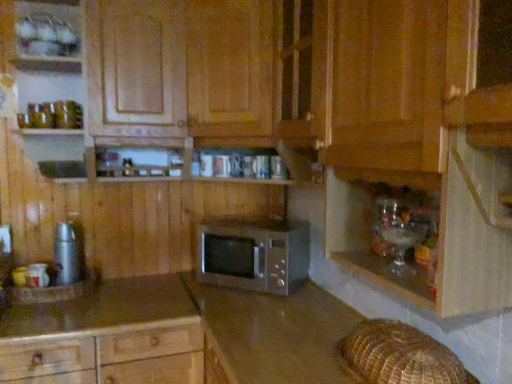
Question: Does wooden microwave at center, marked as the 2th cabinetry in a bottom-to-top arrangement, have a larger size compared to satin brown microwave at center, acting as the second cabinetry starting from the top?

Choices:
 (A) yes
 (B) no

Answer: (A)

Question: Is wooden microwave at center, placed as the first cabinetry when sorted from top to bottom, looking in the opposite direction of satin brown microwave at center, acting as the second cabinetry starting from the top?

Choices:
 (A) no
 (B) yes

Answer: (A)

Question: Can you confirm if wooden microwave at center, placed as the first cabinetry when sorted from top to bottom, is smaller than satin brown microwave at center, acting as the second cabinetry starting from the top?

Choices:
 (A) yes
 (B) no

Answer: (B)

Question: Is satin brown microwave at center, the first cabinetry positioned from the bottom, surrounded by wooden microwave at center, marked as the 2th cabinetry in a bottom-to-top arrangement?

Choices:
 (A) yes
 (B) no

Answer: (B)

Question: From the image's perspective, is wooden microwave at center, marked as the 2th cabinetry in a bottom-to-top arrangement, on satin brown microwave at center, the first cabinetry positioned from the bottom?

Choices:
 (A) yes
 (B) no

Answer: (A)

Question: Is wooden microwave at center, marked as the 2th cabinetry in a bottom-to-top arrangement, outside satin brown microwave at center, the first cabinetry positioned from the bottom?

Choices:
 (A) yes
 (B) no

Answer: (A)

Question: Is wooden microwave at center, marked as the 2th cabinetry in a bottom-to-top arrangement, at the right side of metallic silver thermos at left?

Choices:
 (A) yes
 (B) no

Answer: (A)

Question: Is metallic silver thermos at left inside wooden microwave at center, marked as the 2th cabinetry in a bottom-to-top arrangement?

Choices:
 (A) yes
 (B) no

Answer: (B)

Question: Considering the relative sizes of wooden microwave at center, marked as the 2th cabinetry in a bottom-to-top arrangement, and metallic silver thermos at left in the image provided, is wooden microwave at center, marked as the 2th cabinetry in a bottom-to-top arrangement, wider than metallic silver thermos at left?

Choices:
 (A) yes
 (B) no

Answer: (A)

Question: Considering the relative positions of wooden microwave at center, placed as the first cabinetry when sorted from top to bottom, and metallic silver thermos at left in the image provided, is wooden microwave at center, placed as the first cabinetry when sorted from top to bottom, behind metallic silver thermos at left?

Choices:
 (A) yes
 (B) no

Answer: (B)

Question: Can you confirm if wooden microwave at center, marked as the 2th cabinetry in a bottom-to-top arrangement, is bigger than metallic silver thermos at left?

Choices:
 (A) yes
 (B) no

Answer: (A)

Question: From a real-world perspective, is wooden microwave at center, placed as the first cabinetry when sorted from top to bottom, located beneath metallic silver thermos at left?

Choices:
 (A) yes
 (B) no

Answer: (B)

Question: Is translucent glassware at lower right taller than satin brown microwave at center, acting as the second cabinetry starting from the top?

Choices:
 (A) no
 (B) yes

Answer: (A)